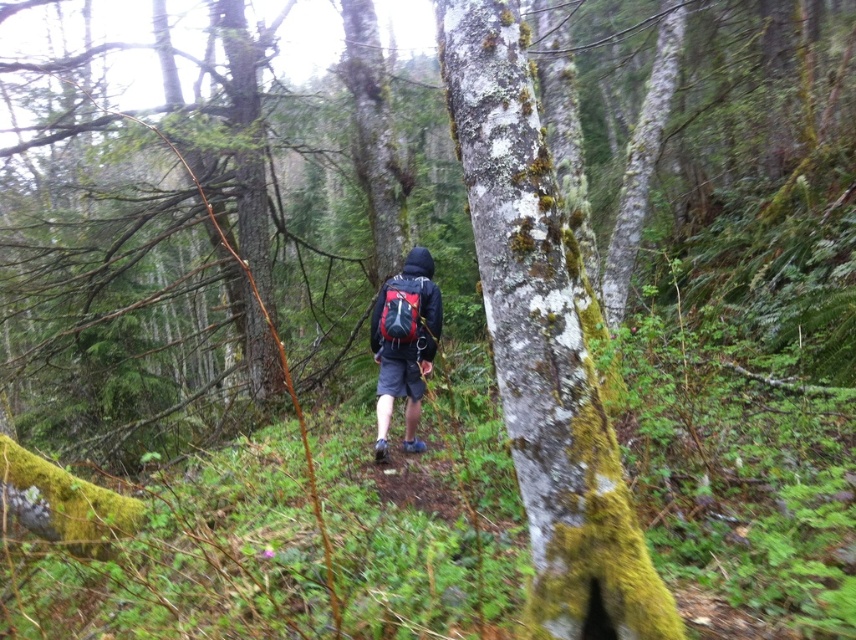
You are a hiker who wants to take a photo of both the green mossy bark tree at center and the matte black jacket at center. Since you want both to be fully visible in the frame, would you need to adjust your camera angle to include both objects given their sizes?

The green mossy bark tree at center is wider than the matte black jacket at center, so you might need to zoom out or move back slightly to ensure both are fully visible in the photo.

You are a hiker who wants to adjust your backpack while walking. Since you can only see the objects in front of you, can you see the matte black backpack at center while looking at the matte black jacket at center?

The matte black backpack at center is behind the matte black jacket at center, so you cannot see the matte black backpack at center while looking at the matte black jacket at center.

You are standing in the forest and see two points marked in the scene. Which point, point [611,499] or point [403,385], is closer to you?

Point [611,499] is closer to you than point [403,385].